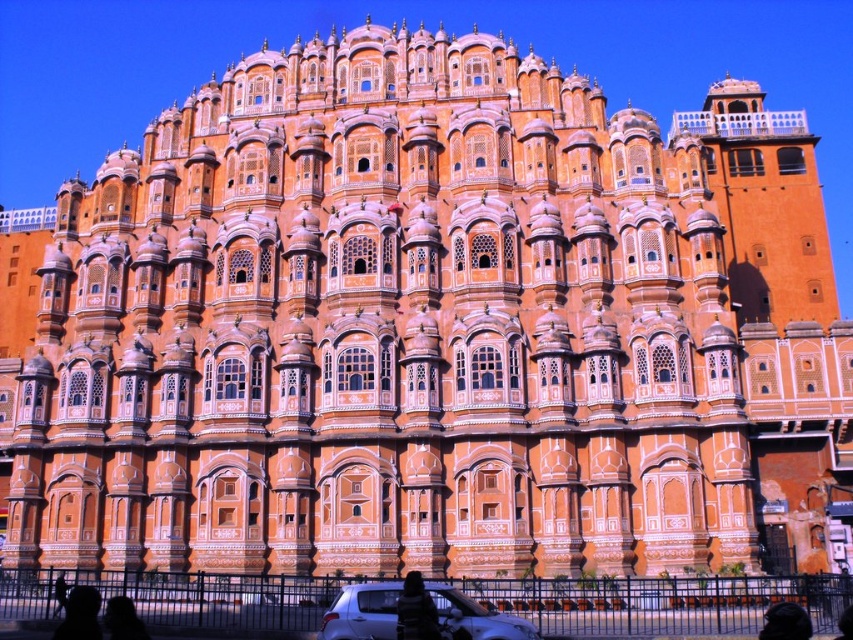
You are a tourist visiting Hawa Mahal and notice a dark gray fabric jacket at lower center and a silhouette figure at lower left. Which object is shorter in height?

The dark gray fabric jacket at lower center has a lesser height compared to the silhouette figure at lower left, so the dark gray fabric jacket at lower center is shorter.

You are a tourist standing in front of the Hawa Mahal in Jaipur. You notice two elements in the foreground of the scene. One is the black fabric at lower right and the other is the silhouette skin at lower left. Which of these two elements is positioned more to the right side of the scene?

The black fabric at lower right is positioned more to the right side of the scene compared to the silhouette skin at lower left.